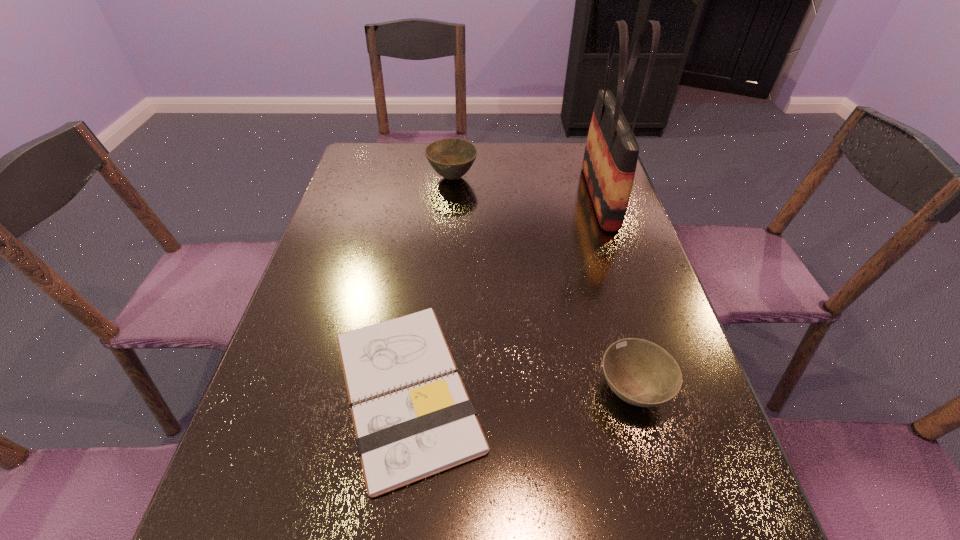
Find the location of a particular element. The height and width of the screenshot is (540, 960). shopping bag is located at coordinates (611, 153).

Find the location of a particular element. the third shortest object is located at coordinates (451, 158).

This screenshot has height=540, width=960. What are the coordinates of `the taller bowl` in the screenshot? It's located at (451, 158).

Identify the location of the nearer bowl. (641, 373).

Locate an element on the screen. This screenshot has height=540, width=960. the shorter bowl is located at coordinates (641, 373).

The width and height of the screenshot is (960, 540). What are the coordinates of `the shortest object` in the screenshot? It's located at (406, 436).

Locate an element on the screen. Image resolution: width=960 pixels, height=540 pixels. free region located 0.150m on the front-facing side of the tallest object is located at coordinates (535, 197).

The width and height of the screenshot is (960, 540). Find the location of `free region located on the front-facing side of the tallest object`. free region located on the front-facing side of the tallest object is located at coordinates (463, 197).

The image size is (960, 540). In order to click on free space located on the front-facing side of the tallest object in this screenshot , I will do `click(505, 197)`.

Find the location of a particular element. This screenshot has width=960, height=540. vacant region located on the front of the farther bowl is located at coordinates (450, 201).